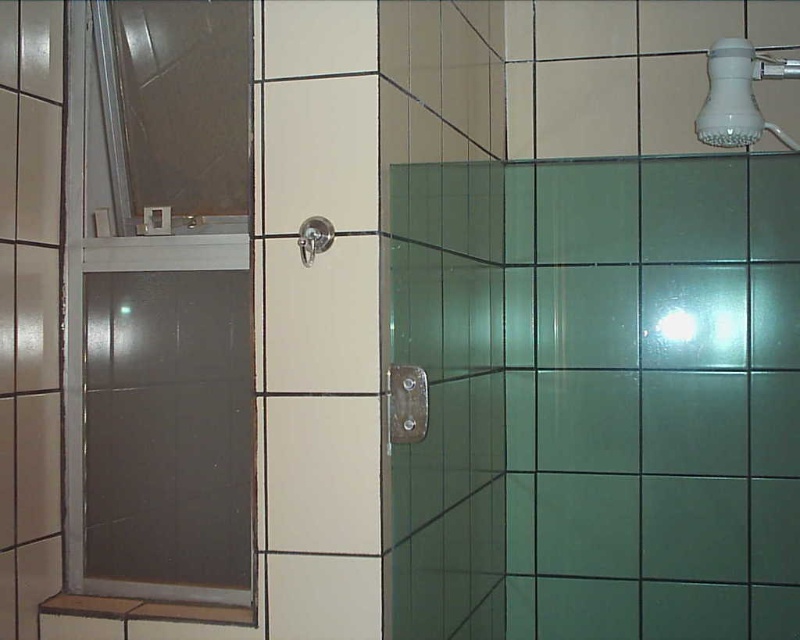
You are standing in the bathroom and need to reach the white plastic shower head at upper right to adjust the water temperature. Which direction should you move relative to the frosted glass door at left?

To reach the white plastic shower head at upper right, you should move to the right side of the frosted glass door at left since the shower head is positioned on the right side of the door.

You are a plumber inspecting a bathroom shower setup. You need to replace the showerheads based on their sizes. Which showerhead between the white plastic shower head at upper right and the satin nickel showerhead at upper center should you choose if you need a wider one for better water coverage?

The white plastic shower head at upper right should be chosen because its width is larger than the satin nickel showerhead at upper center, providing better water coverage.

You are designing a bathroom layout and need to place a new towel rack. The rack must be positioned between the frosted glass door at left and the satin nickel showerhead at upper center. Given their sizes, which object should the rack be closer to?

The frosted glass door at left is larger in size than the satin nickel showerhead at upper center, so the towel rack should be placed closer to the satin nickel showerhead at upper center to maintain balance in the layout.